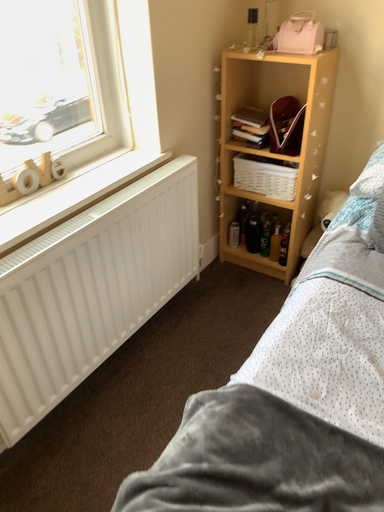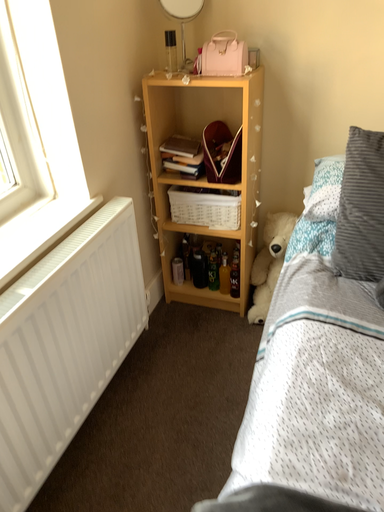
Question: Which way did the camera rotate in the video?

Choices:
 (A) rotated right
 (B) rotated left

Answer: (A)